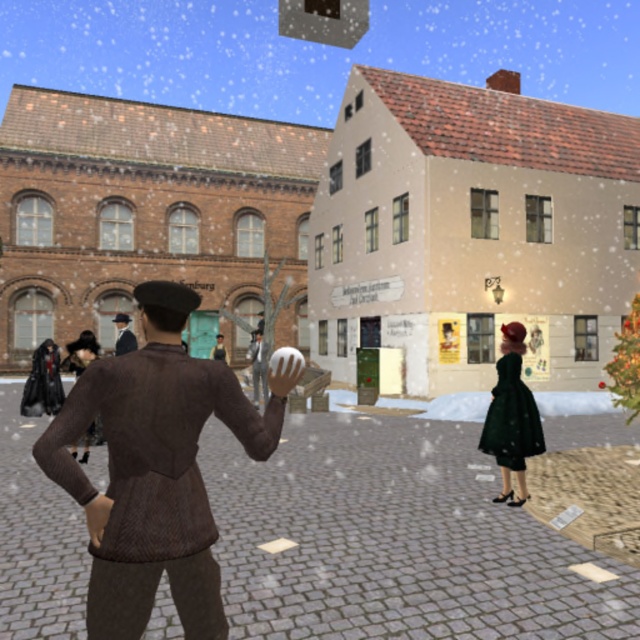
Question: Is velvet green dress at right positioned in front of brown wool coat at center?

Choices:
 (A) no
 (B) yes

Answer: (B)

Question: Is velvet green dress at right to the left of brown wool coat at center from the viewer's perspective?

Choices:
 (A) yes
 (B) no

Answer: (B)

Question: Which point is closer to the camera taking this photo?

Choices:
 (A) (502, 324)
 (B) (216, 337)
 (C) (116, 332)

Answer: (A)

Question: Which point is closer to the camera?

Choices:
 (A) brown leather coat at center
 (B) brown knitted sweater at center
 (C) brown wool coat at center

Answer: (B)

Question: Can you confirm if brown knitted sweater at center is smaller than brown leather coat at center?

Choices:
 (A) yes
 (B) no

Answer: (A)

Question: Which point is closer to the camera?

Choices:
 (A) velvet green dress at right
 (B) brown wool coat at center
 (C) brown knitted sweater at center
 (D) brown leather coat at center

Answer: (C)